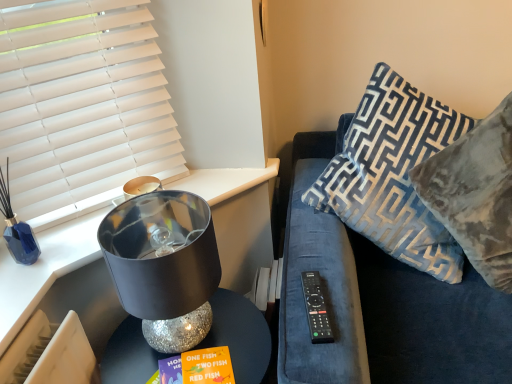
You are a GUI agent. You are given a task and a screenshot of the screen. Output one action in this format:
    pyautogui.click(x=<x>, y=<y>)
    Task: Click on the vacant point above sparkly silver table at lower left (from a real-world perspective)
    This screenshot has height=384, width=512.
    Given the screenshot: What is the action you would take?
    pyautogui.click(x=203, y=346)